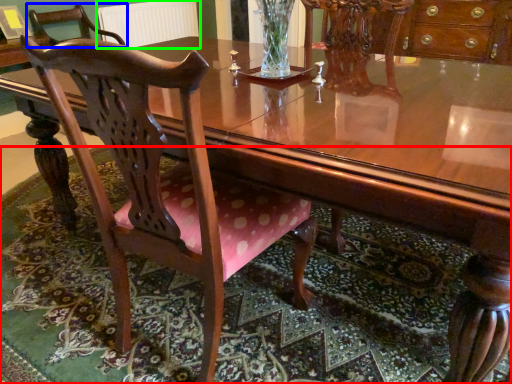
Question: Which object is positioned farthest from mat (highlighted by a red box)? Select from chair (highlighted by a blue box) and radiator (highlighted by a green box).

Choices:
 (A) chair
 (B) radiator

Answer: (A)